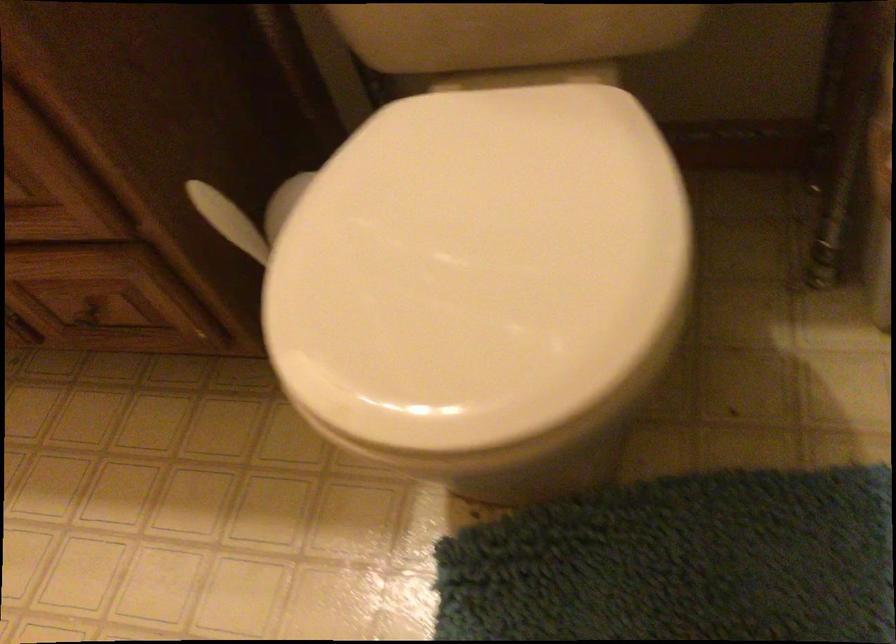
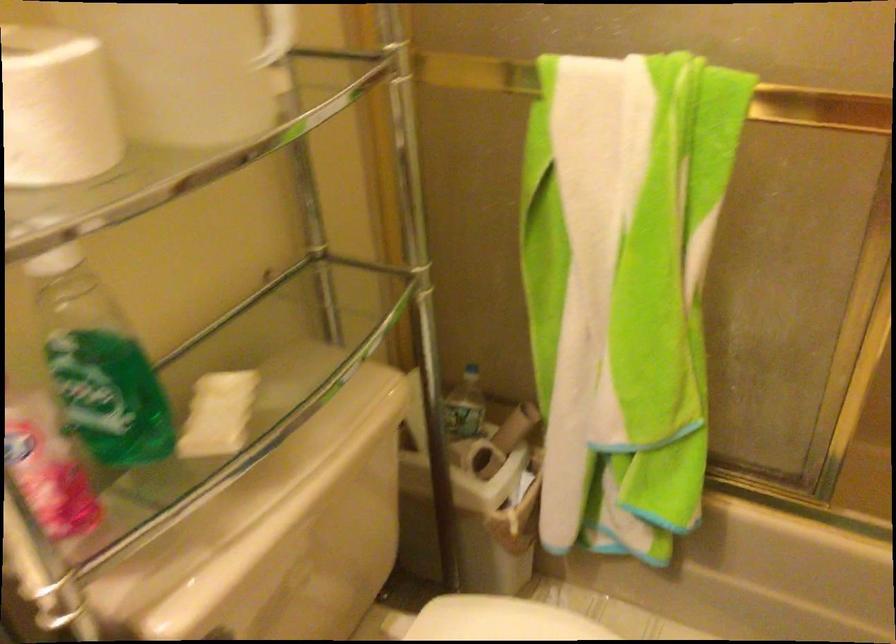
The point at (590, 147) is marked in the first image. Where is the corresponding point in the second image?

(500, 620)